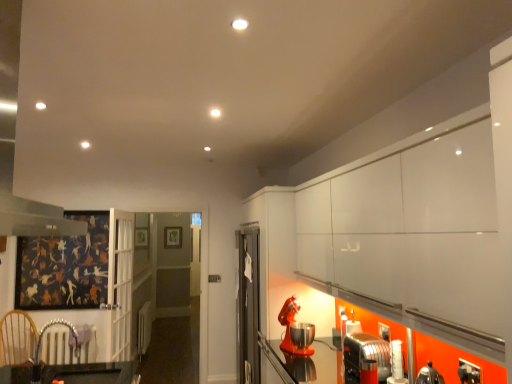
Question: Is the position of orange matte stand mixer at lower right, arranged as the 1th appliance when viewed from the left, more distant than that of metallic silver toaster at lower right, marked as the 1th appliance in a right-to-left arrangement?

Choices:
 (A) yes
 (B) no

Answer: (A)

Question: Does orange matte stand mixer at lower right, positioned as the second appliance in right-to-left order, appear on the right side of metallic silver toaster at lower right, the first appliance when ordered from front to back?

Choices:
 (A) no
 (B) yes

Answer: (A)

Question: Is orange matte stand mixer at lower right, the first appliance positioned from the back, positioned with its back to metallic silver toaster at lower right, marked as the 1th appliance in a right-to-left arrangement?

Choices:
 (A) yes
 (B) no

Answer: (B)

Question: From a real-world perspective, is orange matte stand mixer at lower right, positioned as the second appliance in right-to-left order, positioned under metallic silver toaster at lower right, marked as the 1th appliance in a right-to-left arrangement, based on gravity?

Choices:
 (A) yes
 (B) no

Answer: (B)

Question: From the image's perspective, is orange matte stand mixer at lower right, which is the 2th appliance in front-to-back order, on top of metallic silver toaster at lower right, marked as the 1th appliance in a right-to-left arrangement?

Choices:
 (A) no
 (B) yes

Answer: (B)

Question: Is metallic silver toaster at lower right, the first appliance when ordered from front to back, wider or thinner than wooden armchair at lower left?

Choices:
 (A) wide
 (B) thin

Answer: (B)

Question: From their relative heights in the image, would you say metallic silver toaster at lower right, the 2th appliance from the back, is taller or shorter than wooden armchair at lower left?

Choices:
 (A) tall
 (B) short

Answer: (B)

Question: Is metallic silver toaster at lower right, the first appliance when ordered from front to back, in front of or behind wooden armchair at lower left in the image?

Choices:
 (A) behind
 (B) front

Answer: (B)

Question: Considering the positions of metallic silver toaster at lower right, the 2th appliance from the back, and wooden armchair at lower left in the image, is metallic silver toaster at lower right, the 2th appliance from the back, bigger or smaller than wooden armchair at lower left?

Choices:
 (A) small
 (B) big

Answer: (B)

Question: In terms of size, does orange matte stand mixer at lower right, arranged as the 1th appliance when viewed from the left, appear bigger or smaller than wooden armchair at lower left?

Choices:
 (A) big
 (B) small

Answer: (A)

Question: In terms of width, does orange matte stand mixer at lower right, positioned as the second appliance in right-to-left order, look wider or thinner when compared to wooden armchair at lower left?

Choices:
 (A) thin
 (B) wide

Answer: (A)

Question: Is orange matte stand mixer at lower right, arranged as the 1th appliance when viewed from the left, in front of or behind wooden armchair at lower left in the image?

Choices:
 (A) behind
 (B) front

Answer: (A)

Question: Visually, is orange matte stand mixer at lower right, arranged as the 1th appliance when viewed from the left, positioned to the left or to the right of wooden armchair at lower left?

Choices:
 (A) right
 (B) left

Answer: (A)

Question: From a real-world perspective, is wooden armchair at lower left above or below metallic silver toaster at lower right, marked as the 1th appliance in a right-to-left arrangement?

Choices:
 (A) below
 (B) above

Answer: (B)

Question: Is wooden armchair at lower left in front of or behind metallic silver toaster at lower right, marked as the 1th appliance in a right-to-left arrangement, in the image?

Choices:
 (A) front
 (B) behind

Answer: (B)